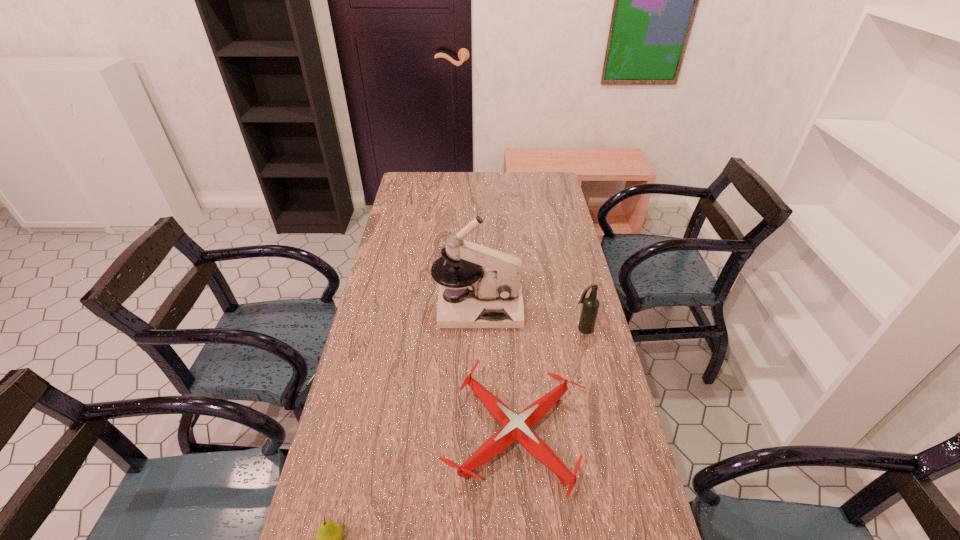
In the image, there is a desktop. In order to click on blank space at the far edge in this screenshot , I will do `click(522, 179)`.

In the image, there is a desktop. Find the location of `vacant space at the left edge`. vacant space at the left edge is located at coordinates (412, 251).

Locate an element on the screen. vacant region at the right edge of the desktop is located at coordinates 635,468.

You are a GUI agent. You are given a task and a screenshot of the screen. Output one action in this format:
    pyautogui.click(x=<x>, y=<y>)
    Task: Click on the vacant space in between the second tallest object and the tallest object
    The height and width of the screenshot is (540, 960).
    Given the screenshot: What is the action you would take?
    pyautogui.click(x=530, y=318)

The image size is (960, 540). In order to click on free area in between the shortest object and the third shortest object in this screenshot , I will do `click(549, 382)`.

The image size is (960, 540). In order to click on blank region between the microscope and the second tallest object in this screenshot , I will do `click(530, 318)`.

Where is `free space between the rightmost object and the shortest object`? The height and width of the screenshot is (540, 960). free space between the rightmost object and the shortest object is located at coordinates (549, 382).

This screenshot has width=960, height=540. Find the location of `free area in between the drone and the rightmost object`. free area in between the drone and the rightmost object is located at coordinates (549, 382).

The height and width of the screenshot is (540, 960). Identify the location of free space between the beer bottle and the tallest object. (530, 318).

This screenshot has height=540, width=960. In order to click on vacant point located between the rightmost object and the tallest object in this screenshot , I will do pos(530,318).